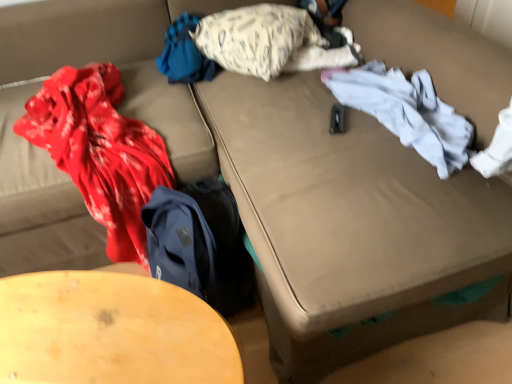
This screenshot has width=512, height=384. Describe the element at coordinates (184, 54) in the screenshot. I see `blue fabric at upper center, marked as the second clothing in a right-to-left arrangement` at that location.

The width and height of the screenshot is (512, 384). Find the location of `white cotton shirt at right, which appears as the first clothing when viewed from the right`. white cotton shirt at right, which appears as the first clothing when viewed from the right is located at coordinates (406, 111).

Identify the location of white textured pillow at upper center. (256, 38).

From a real-world perspective, is white cotton shirt at right, which appears as the first clothing when viewed from the right, located beneath wooden table at lower left?

No, from a real-world perspective, white cotton shirt at right, which appears as the first clothing when viewed from the right, is not under wooden table at lower left.

Which object is positioned more to the left, white cotton shirt at right, the 2th clothing positioned from the left, or wooden table at lower left?

wooden table at lower left.

Is white cotton shirt at right, which appears as the first clothing when viewed from the right, wider than wooden table at lower left?

No, white cotton shirt at right, which appears as the first clothing when viewed from the right, is not wider than wooden table at lower left.

From the image's perspective, is white cotton shirt at right, the 2th clothing positioned from the left, on wooden table at lower left?

A: Yes.

Based on the photo, which of these two, blue fabric at upper center, the 1th clothing viewed from the left, or white cotton shirt at right, which appears as the first clothing when viewed from the right, is wider?

With larger width is blue fabric at upper center, the 1th clothing viewed from the left.

From the image's perspective, is blue fabric at upper center, marked as the second clothing in a right-to-left arrangement, on top of white cotton shirt at right, which appears as the first clothing when viewed from the right?

Yes, from the image's perspective, blue fabric at upper center, marked as the second clothing in a right-to-left arrangement, is on top of white cotton shirt at right, which appears as the first clothing when viewed from the right.

Consider the image. Who is taller, blue fabric at upper center, the 1th clothing viewed from the left, or white cotton shirt at right, which appears as the first clothing when viewed from the right?

blue fabric at upper center, the 1th clothing viewed from the left, is taller.

The image size is (512, 384). What are the coordinates of `clothing that is behind the white cotton shirt at right, the 2th clothing positioned from the left` in the screenshot? It's located at (184, 54).

Which object is further away from the camera, blue fabric at upper center, the 1th clothing viewed from the left, or white textured pillow at upper center?

blue fabric at upper center, the 1th clothing viewed from the left, is behind.

In the scene shown: Considering the relative sizes of blue fabric at upper center, marked as the second clothing in a right-to-left arrangement, and white textured pillow at upper center in the image provided, is blue fabric at upper center, marked as the second clothing in a right-to-left arrangement, thinner than white textured pillow at upper center?

Yes.

From the picture: Is blue fabric at upper center, the 1th clothing viewed from the left, situated inside white textured pillow at upper center or outside?

blue fabric at upper center, the 1th clothing viewed from the left, is not inside white textured pillow at upper center, it's outside.

Are blue fabric at upper center, marked as the second clothing in a right-to-left arrangement, and white textured pillow at upper center beside each other?

No, blue fabric at upper center, marked as the second clothing in a right-to-left arrangement, is not with white textured pillow at upper center.

Which of these two, white textured pillow at upper center or blue fabric at upper center, the 1th clothing viewed from the left, stands shorter?

With less height is blue fabric at upper center, the 1th clothing viewed from the left.

Would you say white textured pillow at upper center contains blue fabric at upper center, marked as the second clothing in a right-to-left arrangement?

Actually, blue fabric at upper center, marked as the second clothing in a right-to-left arrangement, is outside white textured pillow at upper center.

How far apart are white textured pillow at upper center and blue fabric at upper center, the 1th clothing viewed from the left?

white textured pillow at upper center and blue fabric at upper center, the 1th clothing viewed from the left, are 6.23 inches apart.

The width and height of the screenshot is (512, 384). Identify the location of clothing above the white cotton shirt at right, which appears as the first clothing when viewed from the right (from a real-world perspective). (184, 54).

In the scene shown: Which object is more forward, white cotton shirt at right, which appears as the first clothing when viewed from the right, or blue fabric at upper center, the 1th clothing viewed from the left?

white cotton shirt at right, which appears as the first clothing when viewed from the right, is in front.

From the picture: Which is correct: white cotton shirt at right, the 2th clothing positioned from the left, is inside blue fabric at upper center, the 1th clothing viewed from the left, or outside of it?

white cotton shirt at right, the 2th clothing positioned from the left, is located beyond the bounds of blue fabric at upper center, the 1th clothing viewed from the left.

Can you confirm if white cotton shirt at right, which appears as the first clothing when viewed from the right, is wider than blue fabric at upper center, the 1th clothing viewed from the left?

Incorrect, the width of white cotton shirt at right, which appears as the first clothing when viewed from the right, does not surpass that of blue fabric at upper center, the 1th clothing viewed from the left.

Considering the relative sizes of wooden table at lower left and white cotton shirt at right, which appears as the first clothing when viewed from the right, in the image provided, is wooden table at lower left thinner than white cotton shirt at right, which appears as the first clothing when viewed from the right,?

In fact, wooden table at lower left might be wider than white cotton shirt at right, which appears as the first clothing when viewed from the right.

Identify the location of table located on the left of white cotton shirt at right, which appears as the first clothing when viewed from the right. The width and height of the screenshot is (512, 384). (110, 331).

Is wooden table at lower left bigger than white cotton shirt at right, the 2th clothing positioned from the left?

Correct, wooden table at lower left is larger in size than white cotton shirt at right, the 2th clothing positioned from the left.

Is point (87, 271) closer to camera compared to point (438, 105)?

Yes, point (87, 271) is in front of point (438, 105).

Considering the sizes of objects white textured pillow at upper center and wooden table at lower left in the image provided, who is shorter, white textured pillow at upper center or wooden table at lower left?

With less height is white textured pillow at upper center.

From a real-world perspective, is white textured pillow at upper center over wooden table at lower left?

Yes.

Would you say white textured pillow at upper center is outside wooden table at lower left?

white textured pillow at upper center is positioned outside wooden table at lower left.

Is white textured pillow at upper center thinner than wooden table at lower left?

No, white textured pillow at upper center is not thinner than wooden table at lower left.

You are a GUI agent. You are given a task and a screenshot of the screen. Output one action in this format:
    pyautogui.click(x=<x>, y=<y>)
    Task: Click on the 1st clothing positioned above the wooden table at lower left (from a real-world perspective)
    The image size is (512, 384).
    Given the screenshot: What is the action you would take?
    pyautogui.click(x=406, y=111)

In the image, there is a white cotton shirt at right, the 2th clothing positioned from the left. Identify the location of clothing above it (from the image's perspective). The height and width of the screenshot is (384, 512). (184, 54).

Which object lies further to the anchor point wooden table at lower left, white textured pillow at upper center or blue fabric at upper center, the 1th clothing viewed from the left?

white textured pillow at upper center is further to wooden table at lower left.

Looking at the image, which one is located further to white textured pillow at upper center, wooden table at lower left or blue fabric at upper center, marked as the second clothing in a right-to-left arrangement?

The object further to white textured pillow at upper center is wooden table at lower left.

From the picture: Looking at the image, which one is located closer to white textured pillow at upper center, blue fabric at upper center, marked as the second clothing in a right-to-left arrangement, or white cotton shirt at right, the 2th clothing positioned from the left?

Based on the image, blue fabric at upper center, marked as the second clothing in a right-to-left arrangement, appears to be nearer to white textured pillow at upper center.

Which object lies nearer to the anchor point white cotton shirt at right, which appears as the first clothing when viewed from the right, blue fabric at upper center, marked as the second clothing in a right-to-left arrangement, or wooden table at lower left?

Among the two, blue fabric at upper center, marked as the second clothing in a right-to-left arrangement, is located nearer to white cotton shirt at right, which appears as the first clothing when viewed from the right.

Looking at the image, which one is located closer to white textured pillow at upper center, blue fabric at upper center, marked as the second clothing in a right-to-left arrangement, or wooden table at lower left?

Based on the image, blue fabric at upper center, marked as the second clothing in a right-to-left arrangement, appears to be nearer to white textured pillow at upper center.

Estimate the real-world distances between objects in this image. Which object is further from blue fabric at upper center, marked as the second clothing in a right-to-left arrangement, wooden table at lower left or white textured pillow at upper center?

The object further to blue fabric at upper center, marked as the second clothing in a right-to-left arrangement, is wooden table at lower left.

Looking at the image, which one is located further to blue fabric at upper center, marked as the second clothing in a right-to-left arrangement, white textured pillow at upper center or white cotton shirt at right, the 2th clothing positioned from the left?

white cotton shirt at right, the 2th clothing positioned from the left, is further to blue fabric at upper center, marked as the second clothing in a right-to-left arrangement.

Estimate the real-world distances between objects in this image. Which object is closer to white textured pillow at upper center, white cotton shirt at right, the 2th clothing positioned from the left, or wooden table at lower left?

white cotton shirt at right, the 2th clothing positioned from the left, is positioned closer to the anchor white textured pillow at upper center.

Identify the location of clothing between blue fabric at upper center, the 1th clothing viewed from the left, and wooden table at lower left in the up-down direction. (406, 111).

Where is `pillow situated between blue fabric at upper center, marked as the second clothing in a right-to-left arrangement, and white cotton shirt at right, which appears as the first clothing when viewed from the right, from left to right`? This screenshot has width=512, height=384. pillow situated between blue fabric at upper center, marked as the second clothing in a right-to-left arrangement, and white cotton shirt at right, which appears as the first clothing when viewed from the right, from left to right is located at coordinates (256, 38).